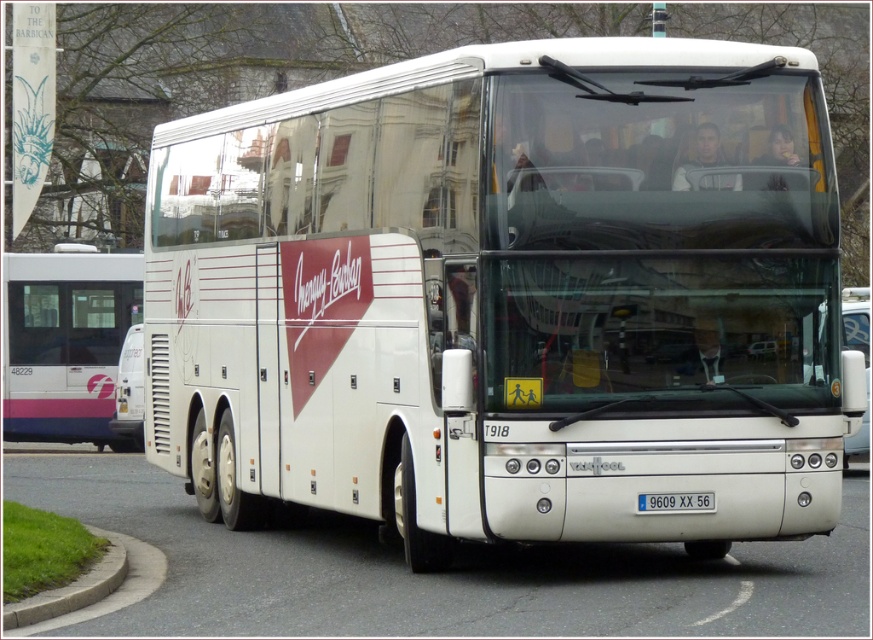
You are a delivery person trying to load a 15 meter long cargo container between the white glossy coach at center and the white glossy bus at left. Can you fit the cargo container between them without moving either vehicle?

The white glossy coach at center and the white glossy bus at left are 14.72 meters apart. Since the cargo container is 15 meters long, it cannot fit between them as the distance is shorter than the container.

You are standing at the center of the image and want to take a photo of the white glossy coach at center. Since the bus is in motion, you need to focus on its registration plate. Where should you aim your camera relative to your current position?

The white glossy coach at center is located at point (507, 296), so you should aim your camera slightly to the right and lower from your current position at the center to focus on its registration plate.

Consider the image. You are standing in front of the Energy Busban T918 coach bus and notice two points marked on its side. The first point is at coordinates point (160, 257) and the second at point (641, 500). Which of these two points is closer to you?

Point (160, 257) is closer to you because it is further to the camera than point (641, 500).